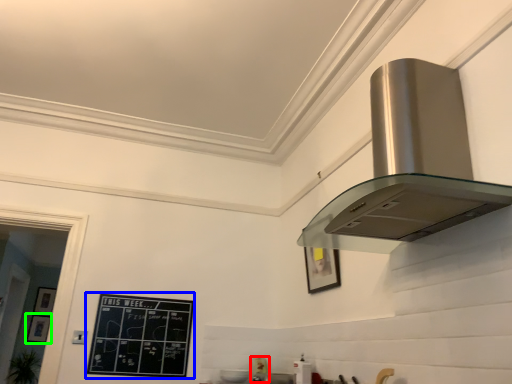
Question: Estimate the real-world distances between objects in this image. Which object is closer to appliance (highlighted by a red box), bulletin board (highlighted by a blue box) or picture frame (highlighted by a green box)?

Choices:
 (A) bulletin board
 (B) picture frame

Answer: (A)